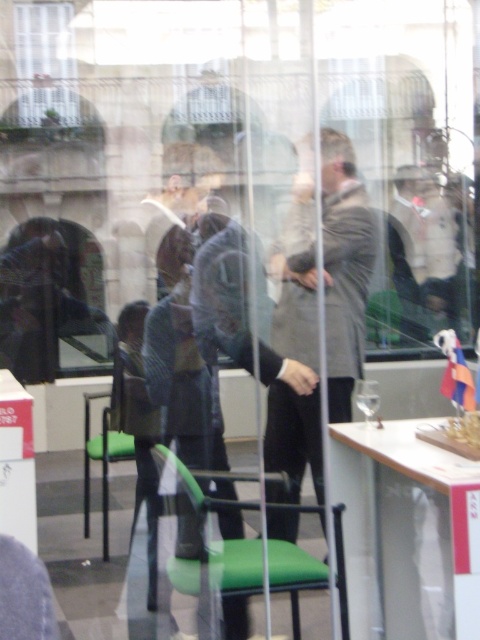
Question: Is gray wool coat at center wider than green plastic chair at center?

Choices:
 (A) no
 (B) yes

Answer: (A)

Question: Does wooden table at center have a larger size compared to green fabric chair at lower left?

Choices:
 (A) no
 (B) yes

Answer: (A)

Question: Which point appears farthest from the camera in this image?

Choices:
 (A) (292, 326)
 (B) (106, 532)
 (C) (29, 148)
 (D) (228, 588)

Answer: (C)

Question: Does transparent glass table at center appear on the right side of gray wool coat at center?

Choices:
 (A) yes
 (B) no

Answer: (B)

Question: Which object is positioned farthest from the green plastic chair at center?

Choices:
 (A) gray wool coat at center
 (B) wooden table at center
 (C) transparent glass table at center
 (D) green fabric chair at lower left

Answer: (C)

Question: Which of these objects is positioned closest to the green fabric chair at lower left?

Choices:
 (A) gray wool coat at center
 (B) wooden table at center

Answer: (A)